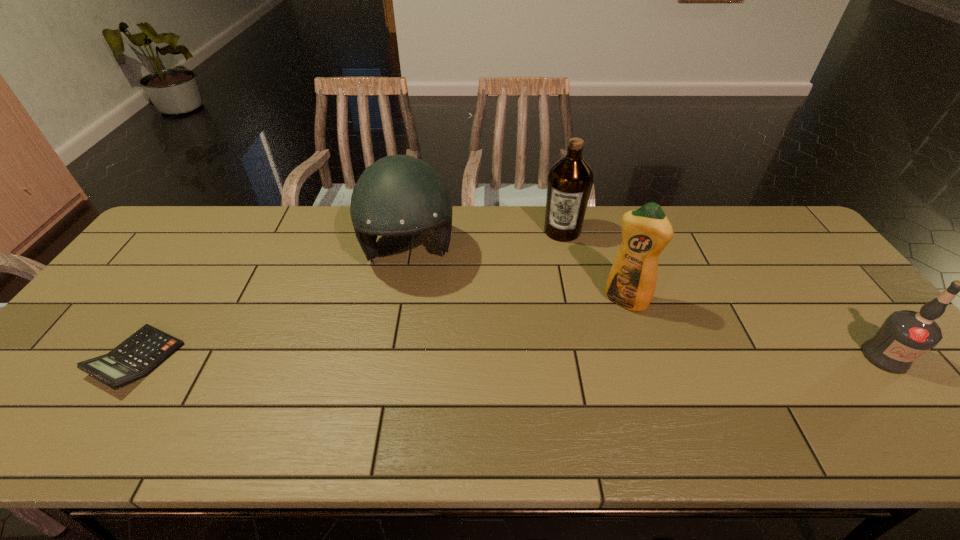
Identify the location of vodka located in the near edge section of the desktop. (905, 335).

Find the location of `object present at the left edge`. object present at the left edge is located at coordinates (136, 357).

Where is `object located at the right edge`? object located at the right edge is located at coordinates (905, 335).

Find the location of `object present at the near left corner`. object present at the near left corner is located at coordinates (136, 357).

The height and width of the screenshot is (540, 960). What are the coordinates of `object that is at the near right corner` in the screenshot? It's located at (905, 335).

Identify the location of free space at the far edge. This screenshot has width=960, height=540. (274, 238).

At what (x,y) coordinates should I click in order to perform the action: click on vacant space at the near edge. Please return your answer as a coordinate pair (x, y). The width and height of the screenshot is (960, 540). Looking at the image, I should click on (435, 408).

Locate an element on the screen. The width and height of the screenshot is (960, 540). vacant space at the right edge of the desktop is located at coordinates (826, 276).

Image resolution: width=960 pixels, height=540 pixels. In the image, there is a desktop. What are the coordinates of `vacant region at the near left corner` in the screenshot? It's located at (67, 403).

This screenshot has height=540, width=960. Find the location of `vacant region at the far right corner`. vacant region at the far right corner is located at coordinates (748, 210).